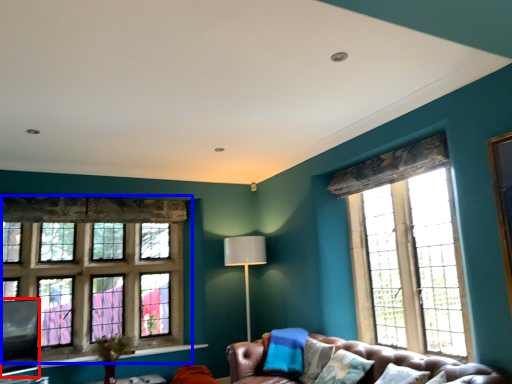
Question: Among these objects, which one is nearest to the camera, window screen (highlighted by a red box) or window (highlighted by a blue box)?

Choices:
 (A) window screen
 (B) window

Answer: (A)